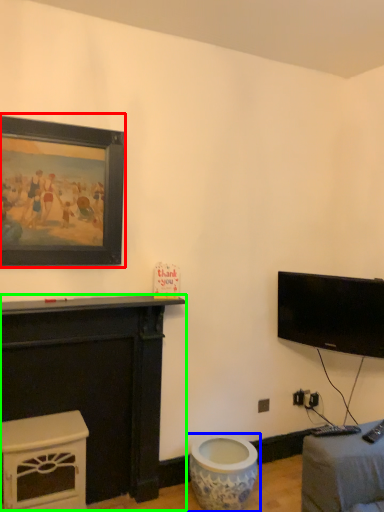
Question: Estimate the real-world distances between objects in this image. Which object is closer to picture frame (highlighted by a red box), toilet (highlighted by a blue box) or furniture (highlighted by a green box)?

Choices:
 (A) toilet
 (B) furniture

Answer: (B)